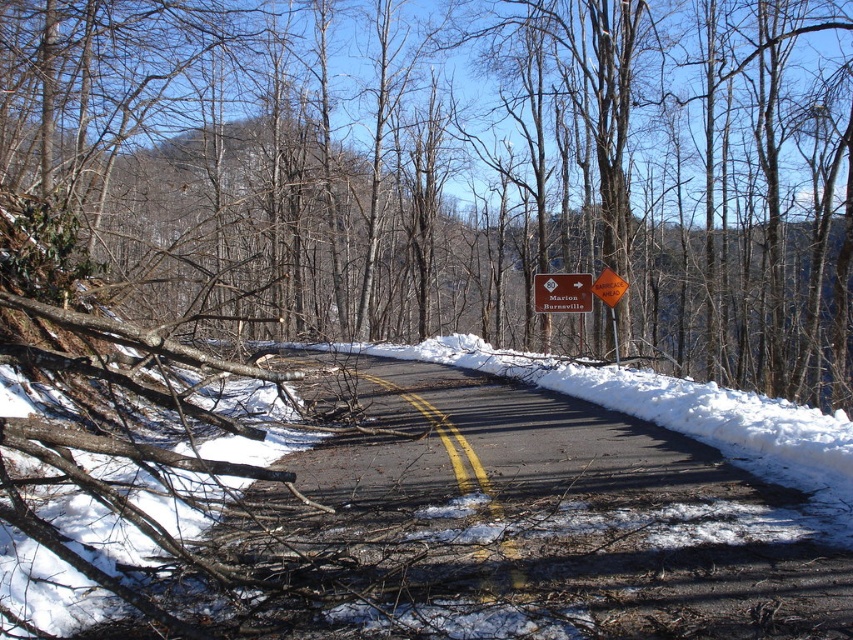
Consider the image. You are a driver approaching the road with two points marked on the image. The first point is at coordinate point (550, 275) and the second is at point (613, 273). Which point is closer to your current position as you drive towards the road?

Point (550, 275) is closer to your current position because it is further to the camera than point (613, 273), meaning it is nearer to the driver.

You are driving a car with a height of 1.8 meters and need to pass through the road shown in the image. The brown wood log at lower left and orange reflective diamond at center are in your path. Which object will first block your vehicle?

The brown wood log at lower left has a greater height compared to orange reflective diamond at center. Since the car is 1.8 meters tall, the brown wood log at lower left may block the vehicle first due to its greater height.

You are driving on a snowy road and see a brown wooden sign at center and an orange reflective diamond at center. Which object is positioned lower on the road?

The brown wooden sign at center is located below the orange reflective diamond at center, so it is positioned lower on the road.